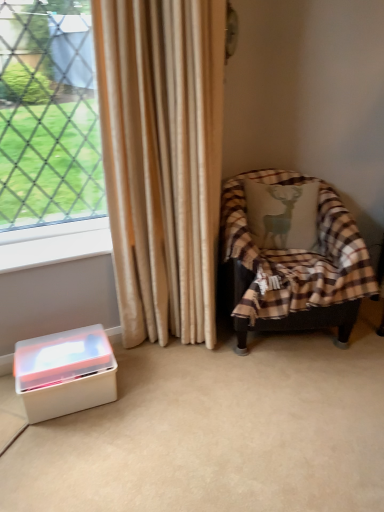
What do you see at coordinates (65, 373) in the screenshot? I see `white plastic container at lower left` at bounding box center [65, 373].

In order to face plaid fabric chair at right, should I rotate leftwards or rightwards?

It's best to rotate right around 12.343 degrees.

Locate an element on the screen. white plastic at lower left is located at coordinates click(54, 244).

In the image, is beige silk curtain at center positioned in front of or behind white plastic container at lower left?

beige silk curtain at center is positioned closer to the viewer than white plastic container at lower left.

Is beige silk curtain at center taller than white plastic container at lower left?

Yes.

Is beige silk curtain at center turned away from white plastic container at lower left?

No, white plastic container at lower left is not at the back of beige silk curtain at center.

From the picture: Considering the sizes of objects beige silk curtain at center and white plastic container at lower left in the image provided, who is thinner, beige silk curtain at center or white plastic container at lower left?

Thinner between the two is white plastic container at lower left.

Would you say white plastic at lower left is a long distance from white plastic container at lower left?

white plastic at lower left is near white plastic container at lower left, not far away.

Is white plastic at lower left to the right of white plastic container at lower left from the viewer's perspective?

No, white plastic at lower left is not to the right of white plastic container at lower left.

Is point (27, 259) positioned behind point (89, 364)?

That is True.

Considering the relative sizes of white plastic at lower left and white plastic container at lower left in the image provided, is white plastic at lower left wider than white plastic container at lower left?

In fact, white plastic at lower left might be narrower than white plastic container at lower left.

Would you say beige silk curtain at center is outside plaid fabric chair at right?

Indeed, beige silk curtain at center is completely outside plaid fabric chair at right.

Are beige silk curtain at center and plaid fabric chair at right beside each other?

No, beige silk curtain at center is not making contact with plaid fabric chair at right.

Considering the relative sizes of beige silk curtain at center and plaid fabric chair at right in the image provided, is beige silk curtain at center taller than plaid fabric chair at right?

Indeed, beige silk curtain at center has a greater height compared to plaid fabric chair at right.

Is point (184, 227) positioned behind point (310, 300)?

No, (184, 227) is in front of (310, 300).

Is white plastic at lower left facing away from beige silk curtain at center?

No.

Is white plastic at lower left in front of or behind beige silk curtain at center in the image?

Visually, white plastic at lower left is located behind beige silk curtain at center.

From the image's perspective, does white plastic at lower left appear higher than beige silk curtain at center?

No, from the image's perspective, white plastic at lower left is not above beige silk curtain at center.

Is white plastic at lower left taller or shorter than beige silk curtain at center?

white plastic at lower left is shorter than beige silk curtain at center.

Identify the location of chair on the right of the white plastic at lower left. Image resolution: width=384 pixels, height=512 pixels. (292, 255).

Is white plastic at lower left aimed at plaid fabric chair at right?

No, white plastic at lower left is not oriented towards plaid fabric chair at right.

Is white plastic at lower left outside of plaid fabric chair at right?

That's correct, white plastic at lower left is outside of plaid fabric chair at right.

Can you confirm if plaid fabric chair at right is smaller than white plastic at lower left?

Incorrect, plaid fabric chair at right is not smaller in size than white plastic at lower left.

From the image's perspective, between plaid fabric chair at right and white plastic at lower left, who is located below?

plaid fabric chair at right.

Which is in front, point (258, 281) or point (9, 238)?

Point (9, 238)

In the scene shown: Which object is wider, plaid fabric chair at right or white plastic at lower left?

plaid fabric chair at right is wider.

Does plaid fabric chair at right have a smaller size compared to beige silk curtain at center?

Actually, plaid fabric chair at right might be larger than beige silk curtain at center.

Is point (352, 315) positioned in front of point (116, 118)?

No.

Can you confirm if plaid fabric chair at right is thinner than beige silk curtain at center?

No, plaid fabric chair at right is not thinner than beige silk curtain at center.

From the image's perspective, is plaid fabric chair at right beneath beige silk curtain at center?

Yes, from the image's perspective, plaid fabric chair at right is beneath beige silk curtain at center.

Identify the location of box located below the beige silk curtain at center (from the image's perspective). The width and height of the screenshot is (384, 512). [65, 373].

Identify the location of window sill that is above the white plastic container at lower left (from the image's perspective). Image resolution: width=384 pixels, height=512 pixels. (54, 244).

Based on their spatial positions, is beige silk curtain at center or plaid fabric chair at right further from white plastic at lower left?

The object further to white plastic at lower left is plaid fabric chair at right.

Consider the image. When comparing their distances from beige silk curtain at center, does white plastic container at lower left or white plastic at lower left seem closer?

Among the two, white plastic at lower left is located nearer to beige silk curtain at center.

Which object lies nearer to the anchor point plaid fabric chair at right, white plastic at lower left or white plastic container at lower left?

white plastic at lower left.

Looking at the image, which one is located closer to beige silk curtain at center, white plastic container at lower left or plaid fabric chair at right?

Among the two, plaid fabric chair at right is located nearer to beige silk curtain at center.

Looking at the image, which one is located closer to white plastic at lower left, white plastic container at lower left or beige silk curtain at center?

beige silk curtain at center is positioned closer to the anchor white plastic at lower left.

When comparing their distances from beige silk curtain at center, does white plastic at lower left or plaid fabric chair at right seem closer?

white plastic at lower left is positioned closer to the anchor beige silk curtain at center.

Consider the image. Estimate the real-world distances between objects in this image. Which object is closer to white plastic container at lower left, plaid fabric chair at right or white plastic at lower left?

white plastic at lower left is closer to white plastic container at lower left.

When comparing their distances from white plastic container at lower left, does plaid fabric chair at right or beige silk curtain at center seem closer?

beige silk curtain at center lies closer to white plastic container at lower left than the other object.

The width and height of the screenshot is (384, 512). I want to click on curtain situated between white plastic container at lower left and plaid fabric chair at right from left to right, so click(x=162, y=160).

In order to click on box between white plastic at lower left and plaid fabric chair at right in the horizontal direction in this screenshot , I will do `click(65, 373)`.

Locate an element on the screen. Image resolution: width=384 pixels, height=512 pixels. curtain between white plastic at lower left and plaid fabric chair at right in the horizontal direction is located at coordinates (162, 160).

Where is `window sill that lies between beige silk curtain at center and white plastic container at lower left from top to bottom`? window sill that lies between beige silk curtain at center and white plastic container at lower left from top to bottom is located at coordinates (54, 244).